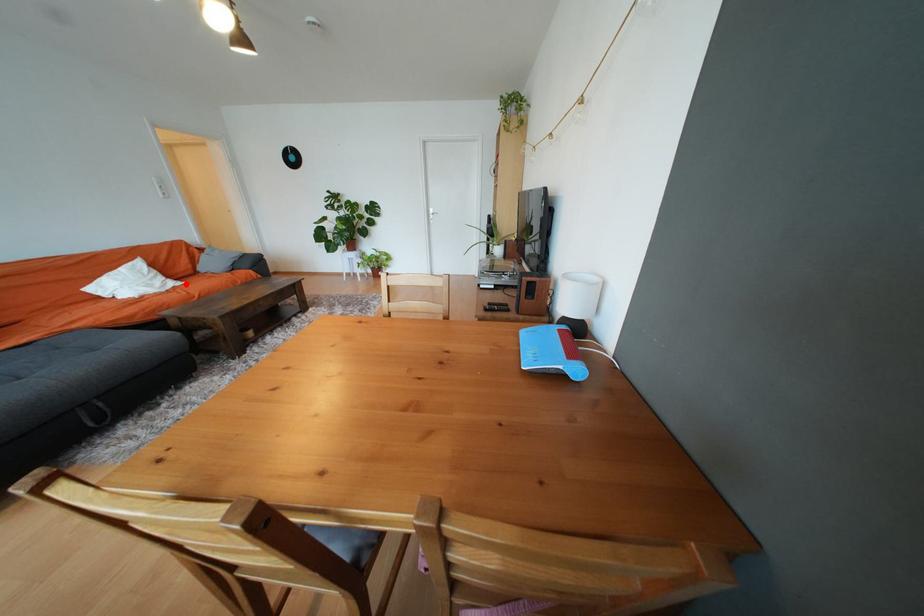
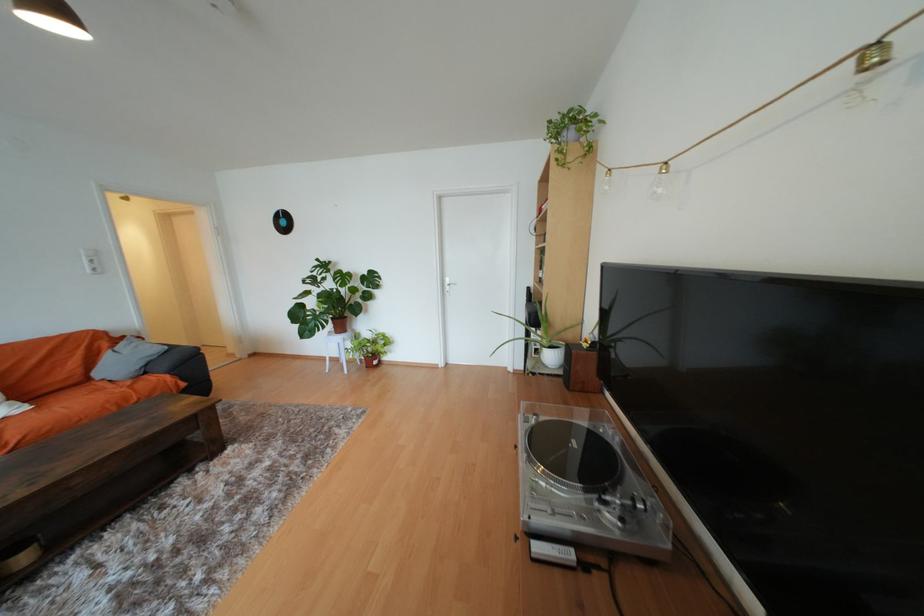
Find the pixel in the second image that matches the highlighted location in the first image.

(31, 410)